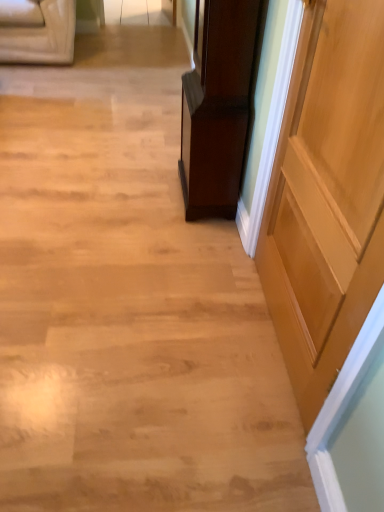
Image resolution: width=384 pixels, height=512 pixels. What do you see at coordinates (327, 197) in the screenshot?
I see `light brown wood door at right` at bounding box center [327, 197].

Where is `light brown wood door at right`? light brown wood door at right is located at coordinates (327, 197).

Measure the distance between point (182, 129) and camera.

Point (182, 129) and camera are 1.99 meters apart from each other.

Describe the element at coordinates (217, 106) in the screenshot. I see `shiny dark wood cabinet at center` at that location.

Locate an element on the screen. shiny dark wood cabinet at center is located at coordinates (217, 106).

Locate an element on the screen. The image size is (384, 512). light brown wood door at right is located at coordinates (327, 197).

From the picture: Considering the relative positions of shiny dark wood cabinet at center and light brown wood door at right in the image provided, is shiny dark wood cabinet at center to the right of light brown wood door at right from the viewer's perspective?

In fact, shiny dark wood cabinet at center is to the left of light brown wood door at right.

Considering their positions, is shiny dark wood cabinet at center located in front of or behind light brown wood door at right?

Clearly, shiny dark wood cabinet at center is behind light brown wood door at right.

Between point (189, 83) and point (293, 162), which one is positioned behind?

The point (189, 83) is farther.

From the image's perspective, is shiny dark wood cabinet at center above or below light brown wood door at right?

Clearly, from the image's perspective, shiny dark wood cabinet at center is above light brown wood door at right.

From a real-world perspective, is shiny dark wood cabinet at center beneath light brown wood door at right?

Yes, from a real-world perspective, shiny dark wood cabinet at center is beneath light brown wood door at right.

Does shiny dark wood cabinet at center have a greater width compared to light brown wood door at right?

Yes, shiny dark wood cabinet at center is wider than light brown wood door at right.

Who is shorter, shiny dark wood cabinet at center or light brown wood door at right?

With less height is shiny dark wood cabinet at center.

Who is bigger, shiny dark wood cabinet at center or light brown wood door at right?

shiny dark wood cabinet at center.

Is light brown wood door at right inside shiny dark wood cabinet at center?

No, light brown wood door at right is located outside of shiny dark wood cabinet at center.

Is shiny dark wood cabinet at center next to light brown wood door at right?

shiny dark wood cabinet at center and light brown wood door at right are clearly separated.

Does shiny dark wood cabinet at center turn towards light brown wood door at right?

No, shiny dark wood cabinet at center does not turn towards light brown wood door at right.

Find the location of a particular element. furniture located underneath the light brown wood door at right (from a real-world perspective) is located at coordinates (217, 106).

Considering the relative positions of light brown wood door at right and shiny dark wood cabinet at center in the image provided, is light brown wood door at right to the right of shiny dark wood cabinet at center from the viewer's perspective?

Yes.

Is light brown wood door at right behind shiny dark wood cabinet at center?

That is False.

Is point (337, 213) positioned after point (255, 25)?

No, (337, 213) is closer to viewer.

From the image's perspective, is light brown wood door at right located above or below shiny dark wood cabinet at center?

light brown wood door at right is situated lower than shiny dark wood cabinet at center in the image.

From a real-world perspective, is light brown wood door at right over shiny dark wood cabinet at center?

Yes, from a real-world perspective, light brown wood door at right is over shiny dark wood cabinet at center

Is light brown wood door at right wider than shiny dark wood cabinet at center?

Incorrect, the width of light brown wood door at right does not surpass that of shiny dark wood cabinet at center.

Between light brown wood door at right and shiny dark wood cabinet at center, which one has more height?

With more height is light brown wood door at right.

In terms of size, does light brown wood door at right appear bigger or smaller than shiny dark wood cabinet at center?

In the image, light brown wood door at right appears to be smaller than shiny dark wood cabinet at center.

Does light brown wood door at right contain shiny dark wood cabinet at center?

No, shiny dark wood cabinet at center is not inside light brown wood door at right.

Is light brown wood door at right positioned far away from shiny dark wood cabinet at center?

They are positioned close to each other.

Is light brown wood door at right looking in the opposite direction of shiny dark wood cabinet at center?

That's not correct — light brown wood door at right is not looking away from shiny dark wood cabinet at center.

What's the angular difference between light brown wood door at right and shiny dark wood cabinet at center's facing directions?

light brown wood door at right and shiny dark wood cabinet at center are facing 2.72 degrees away from each other.

Locate an element on the screen. The height and width of the screenshot is (512, 384). door that is on the right side of shiny dark wood cabinet at center is located at coordinates (327, 197).

The height and width of the screenshot is (512, 384). I want to click on furniture behind the light brown wood door at right, so (217, 106).

In order to click on door positioned vertically above the shiny dark wood cabinet at center (from a real-world perspective) in this screenshot , I will do `click(327, 197)`.